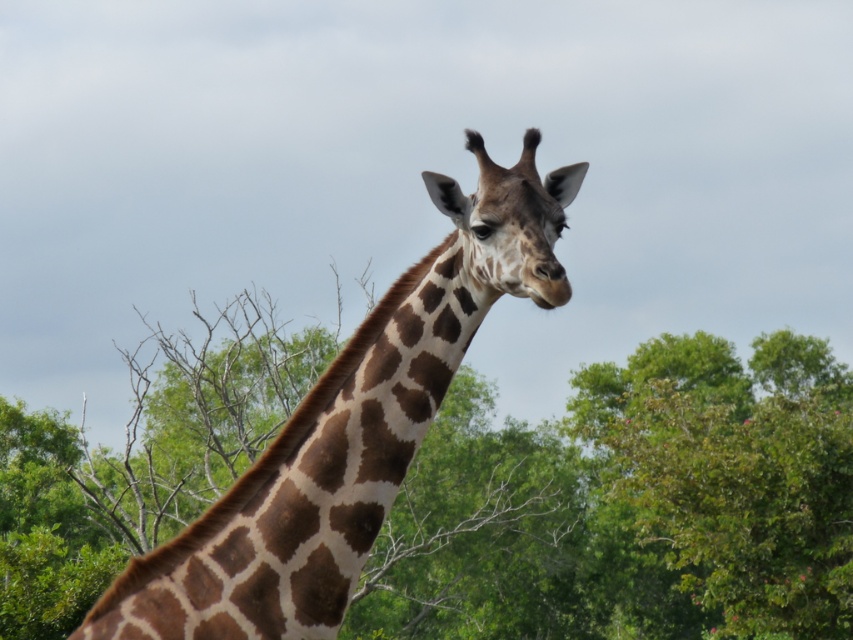
You are standing in front of the giraffe on the left side of the frame. You want to walk towards the green leafy tree at center. Which direction should you move in relation to the giraffe?

You should move towards the center of the frame to reach the green leafy tree at center, which is located at point coordinates of (631, 504).

Looking at this image, you are standing in front of the giraffe on the left side of the image. There is a point at coordinates [631,504]. Based on the scene description, can you determine which object this point is located on?

The point at coordinates [631,504] is located on the green leafy tree at center.

You are standing in front of the image and want to determine the spatial relationship between the two points. Which point is closer to you, point (x=515, y=452) or point (x=509, y=250)?

Answer: Point (x=509, y=250) is closer to you because the Objects Description states that point (x=515, y=452) is behind point (x=509, y=250).